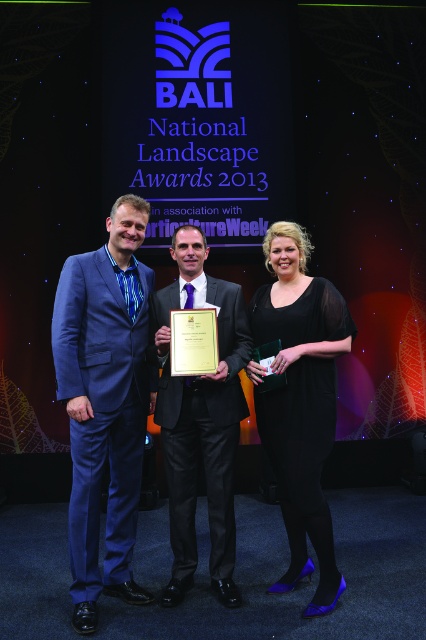
Can you confirm if black satin dress at center is positioned to the right of shiny black suit at center?

Yes, black satin dress at center is to the right of shiny black suit at center.

Consider the image. Does black satin dress at center have a larger size compared to shiny black suit at center?

Indeed, black satin dress at center has a larger size compared to shiny black suit at center.

Does point (299, 552) come closer to viewer compared to point (203, 387)?

No, (299, 552) is behind (203, 387).

You are a GUI agent. You are given a task and a screenshot of the screen. Output one action in this format:
    pyautogui.click(x=<x>, y=<y>)
    Task: Click on the black satin dress at center
    
    Given the screenshot: What is the action you would take?
    pyautogui.click(x=299, y=401)

Which is behind, point (146, 376) or point (230, 497)?

Point (146, 376)

Who is positioned more to the right, blue velvet suit at left or shiny black suit at center?

Positioned to the right is shiny black suit at center.

Is point (124, 468) less distant than point (163, 344)?

No, it is behind (163, 344).

Identify the location of blue velvet suit at left. [x=104, y=403].

Consider the image. Is blue velvet suit at left above black satin dress at center?

Yes.

Measure the distance from blue velvet suit at left to black satin dress at center.

blue velvet suit at left is 26.03 inches from black satin dress at center.

Find the location of `blue velvet suit at left`. blue velvet suit at left is located at coordinates (104, 403).